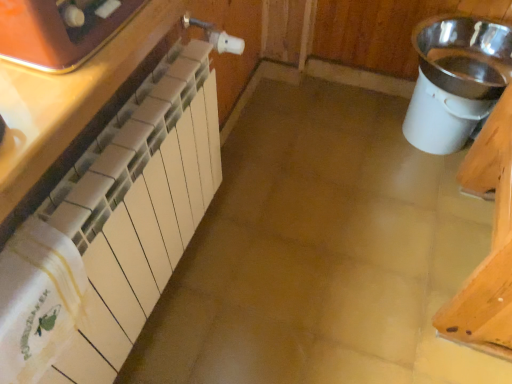
Find the location of a particular element. Image resolution: width=512 pixels, height=384 pixels. vacant region in front of matte orange toaster at upper left is located at coordinates (49, 92).